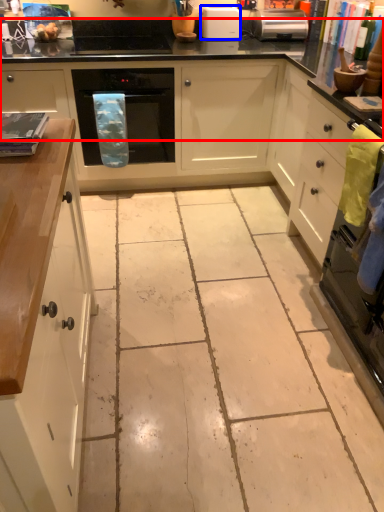
Question: Which object is further to the camera taking this photo, countertop (highlighted by a red box) or kitchen appliance (highlighted by a blue box)?

Choices:
 (A) countertop
 (B) kitchen appliance

Answer: (B)